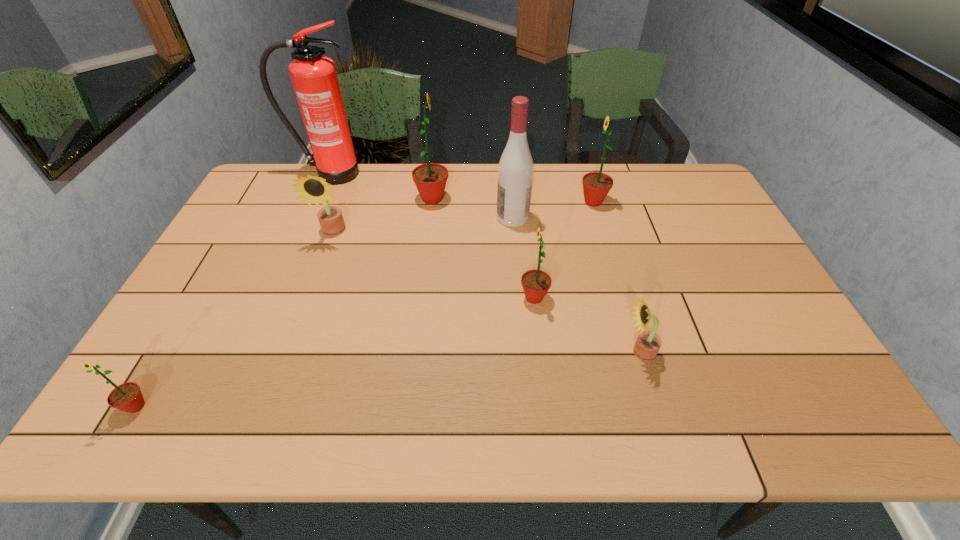
Find the location of a particular element. fire extinguisher that is at the far edge is located at coordinates (314, 77).

The height and width of the screenshot is (540, 960). I want to click on object situated at the near edge, so click(127, 397).

Identify the location of fire extinguisher that is at the left edge. The image size is (960, 540). (314, 77).

Locate an element on the screen. The width and height of the screenshot is (960, 540). sunflower positioned at the left edge is located at coordinates pyautogui.click(x=127, y=397).

This screenshot has width=960, height=540. I want to click on object that is at the far left corner, so click(314, 77).

The width and height of the screenshot is (960, 540). I want to click on object that is at the near left corner, so click(x=127, y=397).

Find the location of a particular element. This screenshot has height=540, width=960. vacant region at the far edge is located at coordinates (388, 180).

In the image, there is a desktop. Where is `free space at the near edge`? The width and height of the screenshot is (960, 540). free space at the near edge is located at coordinates (290, 397).

The width and height of the screenshot is (960, 540). In the image, there is a desktop. Find the location of `vacant space at the left edge`. vacant space at the left edge is located at coordinates (201, 357).

At what (x,y) coordinates should I click in order to perform the action: click on vacant space at the right edge. Please return your answer as a coordinate pair (x, y). Image resolution: width=960 pixels, height=540 pixels. Looking at the image, I should click on (804, 354).